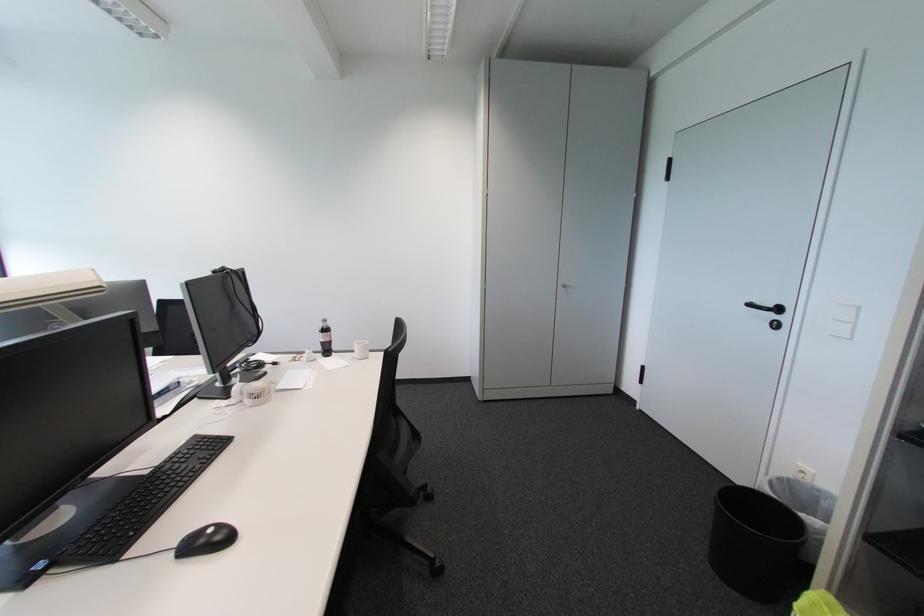
Find the location of `cabinet door knob`. cabinet door knob is located at coordinates (565, 285).